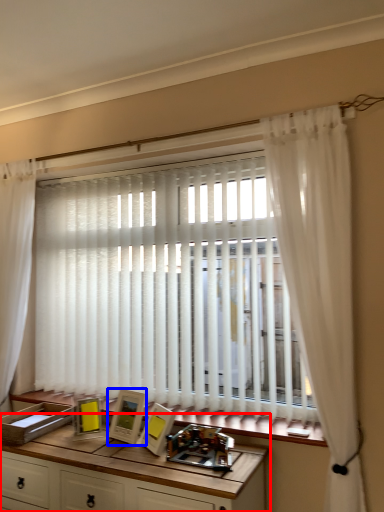
Question: Which point is closer to the camera, table (highlighted by a red box) or picture frame (highlighted by a blue box)?

Choices:
 (A) table
 (B) picture frame

Answer: (A)